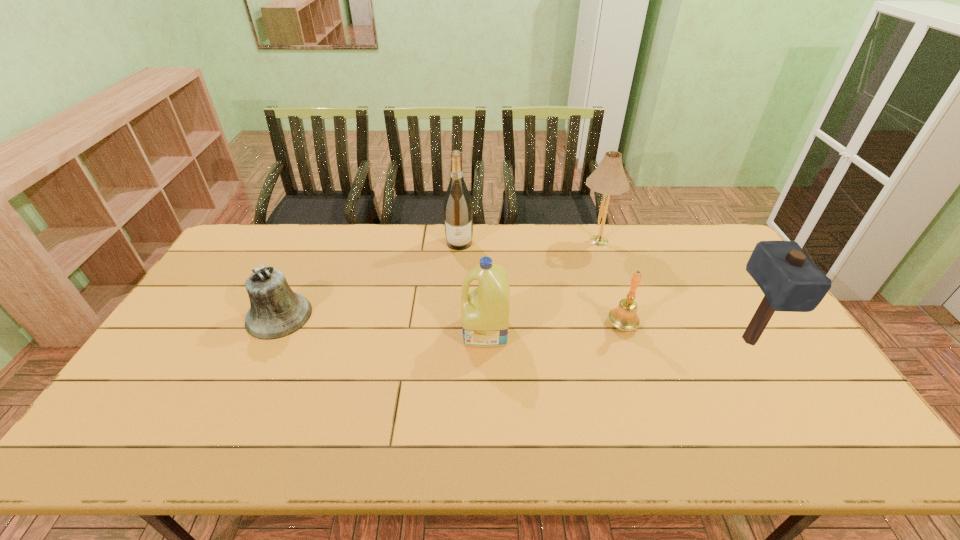
In the image, there is a desktop. What are the coordinates of `vacant space at the right edge` in the screenshot? It's located at (721, 266).

Where is `vacant region at the far left corner of the desktop`? This screenshot has width=960, height=540. vacant region at the far left corner of the desktop is located at coordinates (266, 224).

In the image, there is a desktop. Identify the location of vacant space at the far right corner. The height and width of the screenshot is (540, 960). [713, 245].

Find the location of a particular element. free space between the detergent and the wine bottle is located at coordinates (472, 287).

Locate an element on the screen. The width and height of the screenshot is (960, 540). empty location between the fourth tallest object and the rightmost object is located at coordinates (617, 335).

Identify the location of free space between the wine bottle and the detergent. Image resolution: width=960 pixels, height=540 pixels. (472, 287).

Locate an element on the screen. The image size is (960, 540). vacant point located between the right bell and the rightmost object is located at coordinates (685, 332).

Locate an element on the screen. The width and height of the screenshot is (960, 540). vacant region between the wine bottle and the lampshade is located at coordinates (527, 242).

At what (x,y) coordinates should I click in order to perform the action: click on vacant area that lies between the detergent and the leftmost object. Please return your answer as a coordinate pair (x, y). This screenshot has width=960, height=540. Looking at the image, I should click on (382, 323).

Locate an element on the screen. free space between the wine bottle and the lampshade is located at coordinates (527, 242).